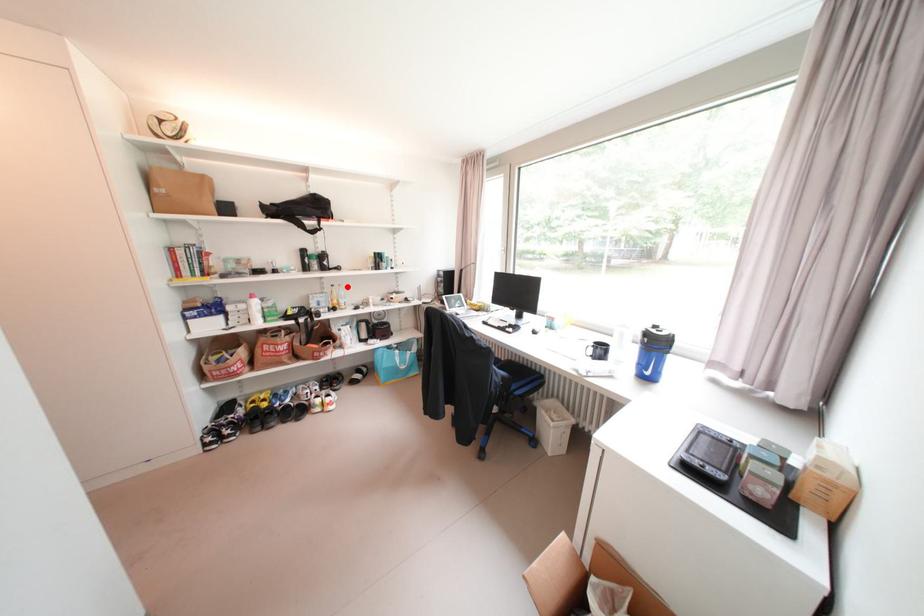
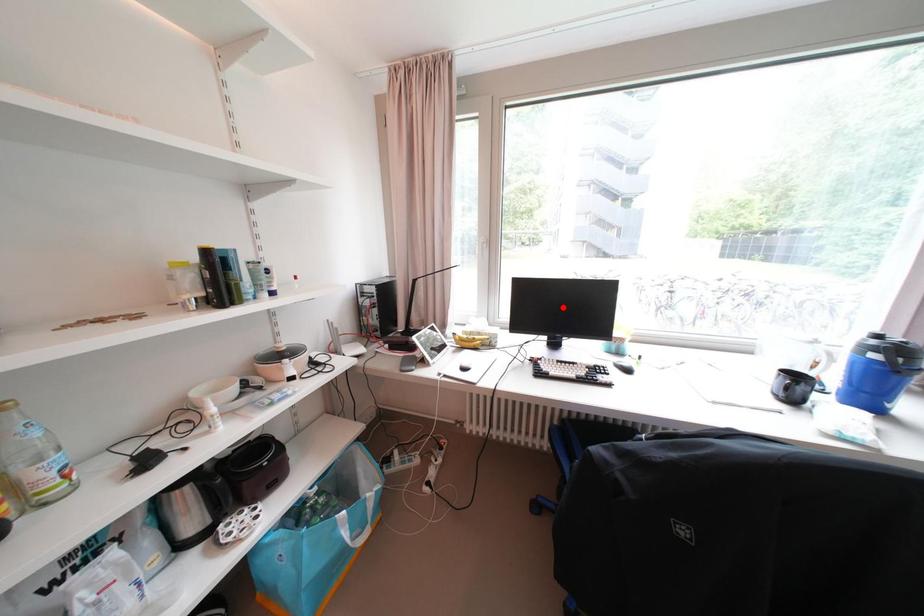
I am providing you with two images of the same scene from different viewpoints. A red point is marked on the first image and another point is marked on the second image. Does the point marked in image1 correspond to the same location as the one in image2?

No